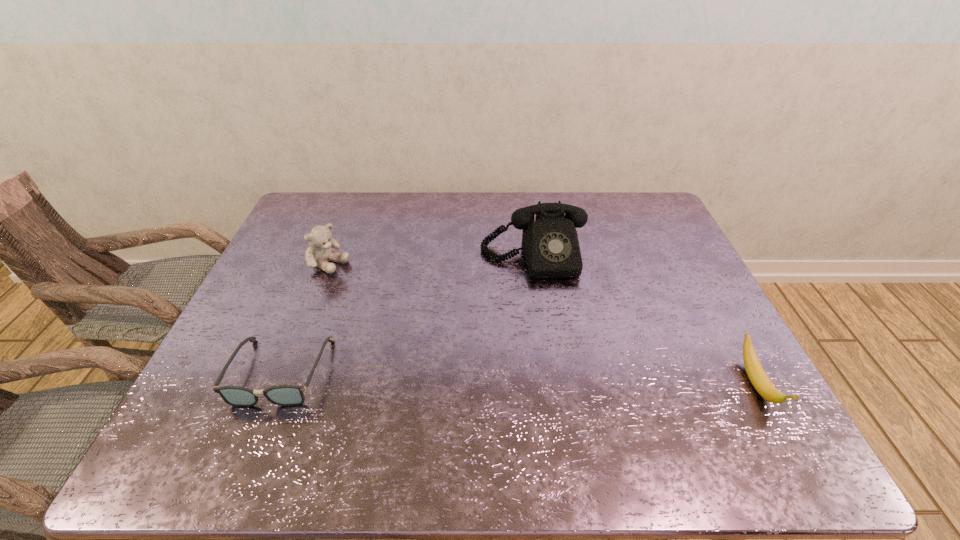
Locate an element on the screen. free spot between the telephone and the teddy bear is located at coordinates (431, 261).

Where is `vacant area that lies between the second object from right to left and the teddy bear`? vacant area that lies between the second object from right to left and the teddy bear is located at coordinates (431, 261).

This screenshot has height=540, width=960. Identify the location of empty space that is in between the banana and the spectacles. (518, 378).

Locate which object is the third closest to the third tallest object. Please provide its 2D coordinates. Your answer should be formatted as a tuple, i.e. [(x, y)], where the tuple contains the x and y coordinates of a point satisfying the conditions above.

[(319, 252)]

Find the location of a particular element. The image size is (960, 540). object that ranks as the third closest to the shortest object is located at coordinates (756, 374).

The width and height of the screenshot is (960, 540). Identify the location of blank area in the image that satisfies the following two spatial constraints: 1. on the back side of the telephone; 2. on the left side of the teddy bear. (331, 257).

The image size is (960, 540). What are the coordinates of `free location that satisfies the following two spatial constraints: 1. on the back side of the teddy bear; 2. on the left side of the telephone` in the screenshot? It's located at (331, 257).